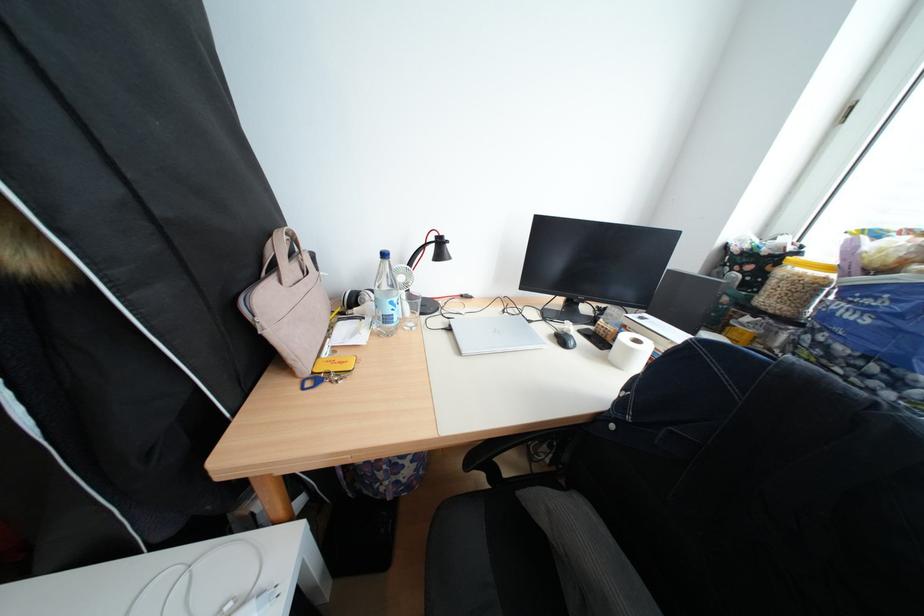
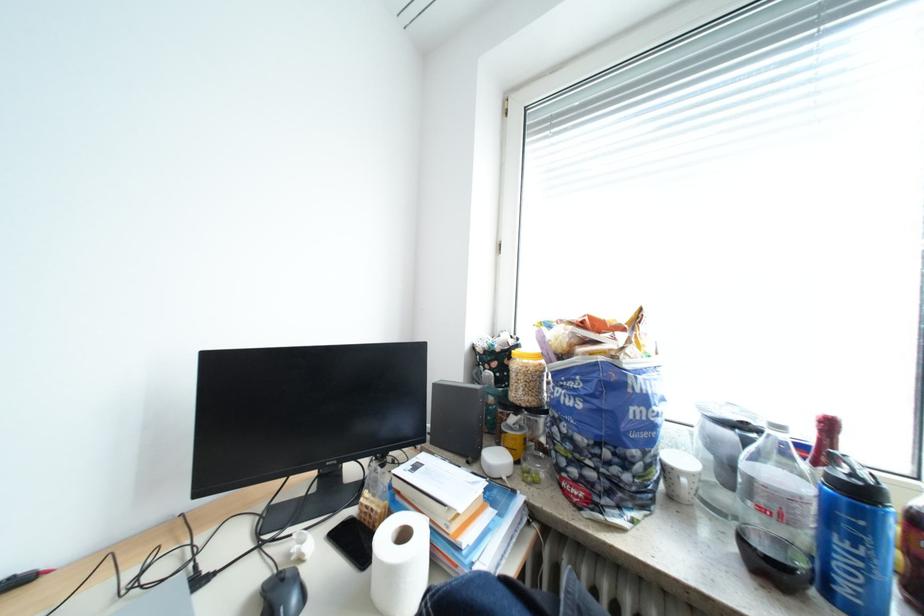
First-person continuous shooting, in which direction is the camera rotating?

The rotation direction of the camera is right-up.